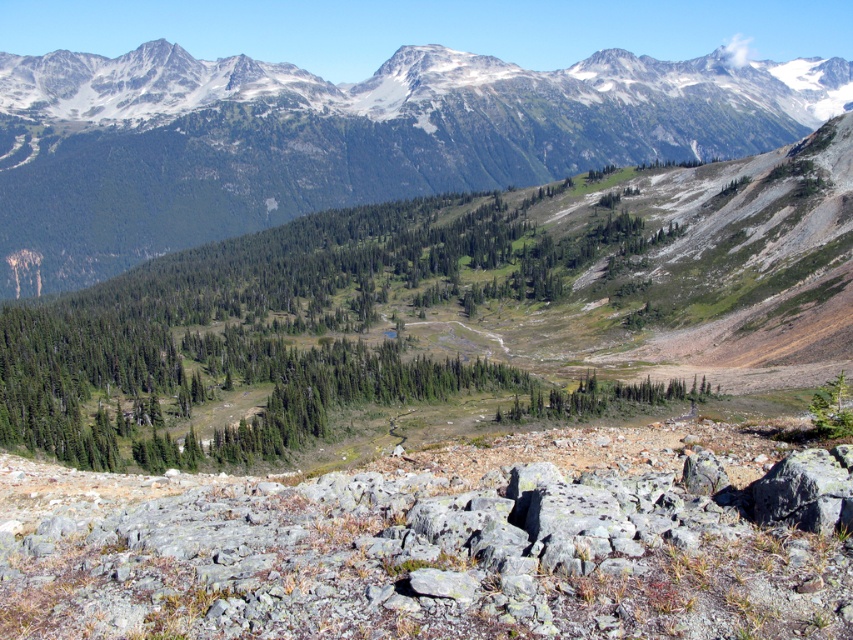
Question: Is the position of gray rock at center more distant than that of green forested mountain range at upper center?

Choices:
 (A) yes
 (B) no

Answer: (B)

Question: Among these points, which one is farthest from the camera?

Choices:
 (A) (253, 497)
 (B) (55, 140)

Answer: (B)

Question: Which object appears closest to the camera in this image?

Choices:
 (A) gray rock at center
 (B) green forested mountain range at upper center

Answer: (A)

Question: Which object appears closest to the camera in this image?

Choices:
 (A) gray rock at center
 (B) green forested mountain range at upper center

Answer: (A)

Question: Can you confirm if gray rock at center is positioned to the left of green forested mountain range at upper center?

Choices:
 (A) no
 (B) yes

Answer: (B)

Question: Considering the relative positions of gray rock at center and green forested mountain range at upper center in the image provided, where is gray rock at center located with respect to green forested mountain range at upper center?

Choices:
 (A) above
 (B) below

Answer: (B)